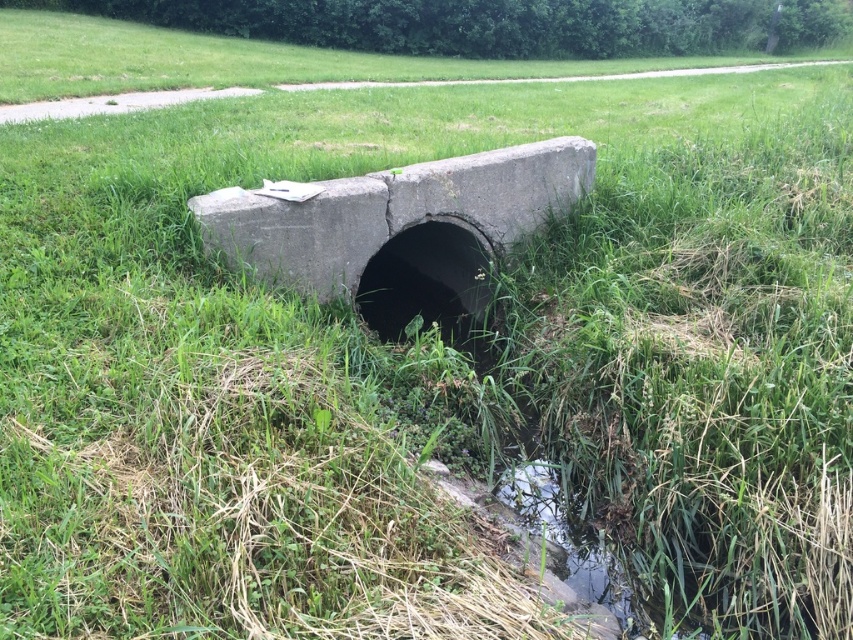
Question: Does gray concrete culvert at center appear over concrete pipe at center?

Choices:
 (A) no
 (B) yes

Answer: (B)

Question: Among these objects, which one is nearest to the camera?

Choices:
 (A) gray concrete culvert at center
 (B) concrete pipe at center

Answer: (A)

Question: Does gray concrete culvert at center have a smaller size compared to concrete pipe at center?

Choices:
 (A) yes
 (B) no

Answer: (B)

Question: Which point is farther to the camera?

Choices:
 (A) concrete pipe at center
 (B) gray concrete culvert at center

Answer: (A)

Question: Can you confirm if gray concrete culvert at center is positioned above concrete pipe at center?

Choices:
 (A) yes
 (B) no

Answer: (A)